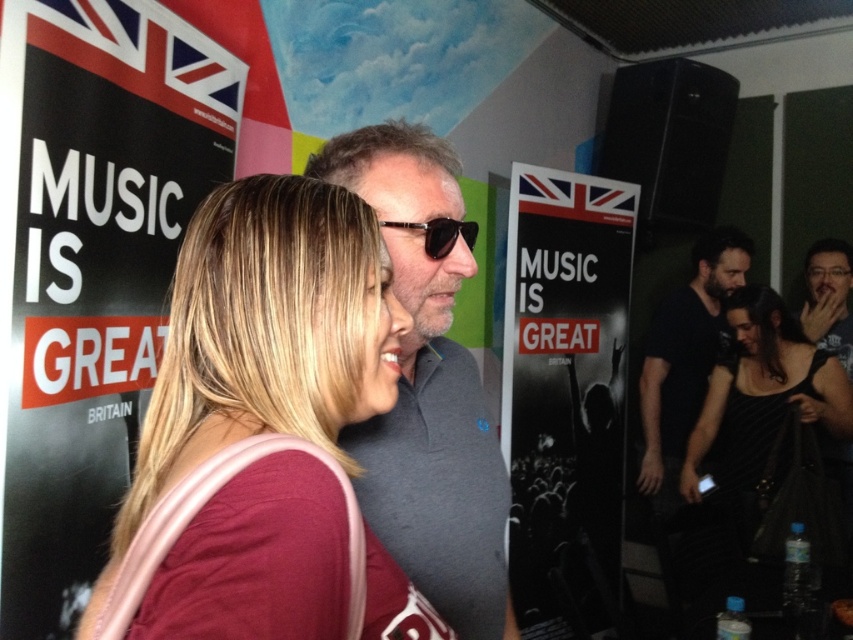
You are standing in the event venue and want to approach the man wearing the gray fabric shirt at center. If your stride length is 28 inches, how many steps do you need to take to reach him?

The distance between you and the gray fabric shirt at center is 30.72 inches. With each step covering 28 inches, you would need to take 2 steps to cover the distance, as 2 steps would get you 56 inches, which is more than enough. However, since the exact distance is 30.72 inches, one step would suffice, but since you can only take whole steps, you would need to take 2 steps to ensure you reach or surpass the distance.

You are organizing a photo shoot and need to arrange two shirts for a display. The gray fabric shirt at center and the black matte shirt at right must be placed on a rack. Which shirt should be placed on the lower rack if the shorter one needs to be displayed at the bottom?

The gray fabric shirt at center is shorter than the black matte shirt at right, so it should be placed on the lower rack.

You are organizing a charity event and need to decide which of the two shirts, the gray fabric shirt at center or the black matte shirt at right, would be more suitable for a slim fit. Based on the description, which one should you choose?

The gray fabric shirt at center is thinner than the black matte shirt at right, so the gray fabric shirt at center would be more suitable for a slim fit.